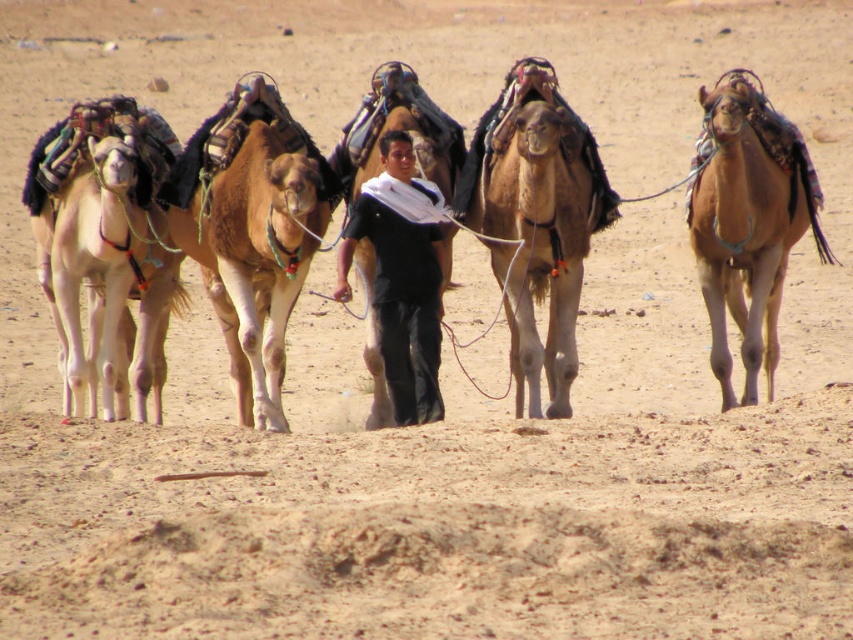
You are a traveler in the desert who needs to cross a narrow sand dune that is 3 meters wide. You see the brown textured camel at center and the brown matte camel at right. Can both camels fit side by side on the sand dune without overlapping?

The brown textured camel at center is 3.09 meters away from the brown matte camel at right. Since the sand dune is only 3 meters wide, the distance between them is slightly more than the dune width, so both camels cannot fit side by side without overlapping.

You are a traveler in the desert and see the brown fuzzy camel at center and the light beige fabric camel at left. Which camel is positioned to the right of the other?

The brown fuzzy camel at center is positioned to the right of the light beige fabric camel at left.

You are a traveler in the desert and need to choose between the brown matte camel at right and the black cotton shirt at center for carrying supplies. Which one has a larger width to carry more items?

The brown matte camel at right has a larger width than the black cotton shirt at center, so it can carry more items.